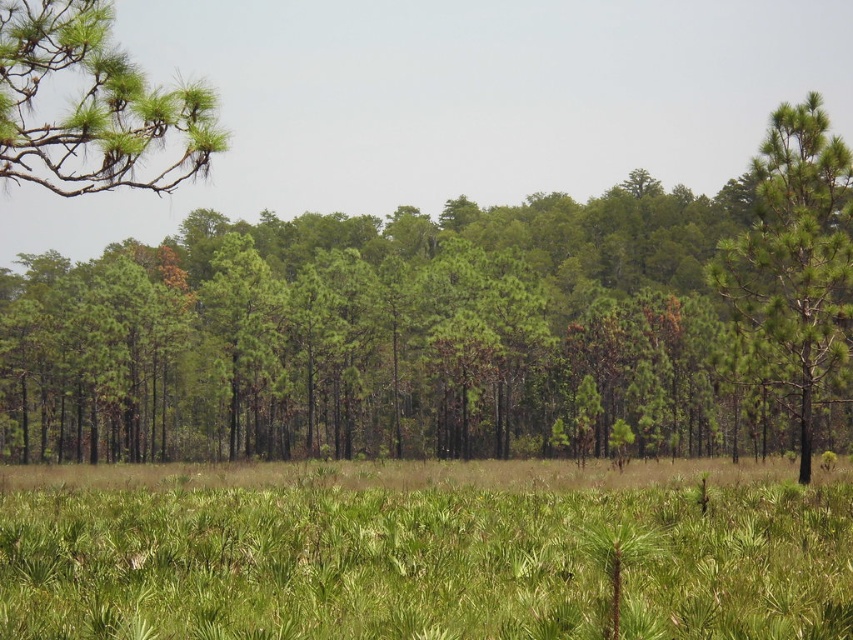
Question: Can you confirm if green leafy grass at center is positioned to the right of green needle-like leaves at upper left?

Choices:
 (A) yes
 (B) no

Answer: (A)

Question: Which object is the farthest from the green leafy tree at center?

Choices:
 (A) green needle-like leaves at upper left
 (B) green textured pine tree at right
 (C) green leafy grass at center

Answer: (A)

Question: Which of the following is the closest to the observer?

Choices:
 (A) green needle-like leaves at upper left
 (B) green leafy grass at center
 (C) green leafy tree at center
 (D) green textured pine tree at right

Answer: (B)

Question: Is green leafy tree at center in front of green textured pine tree at right?

Choices:
 (A) yes
 (B) no

Answer: (B)

Question: Which of the following is the farthest from the observer?

Choices:
 (A) green textured pine tree at right
 (B) green leafy grass at center
 (C) green leafy tree at center
 (D) green needle-like leaves at upper left

Answer: (C)

Question: Can you confirm if green leafy grass at center is thinner than green needle-like leaves at upper left?

Choices:
 (A) no
 (B) yes

Answer: (A)